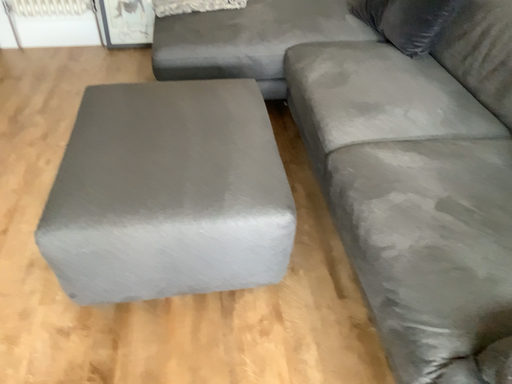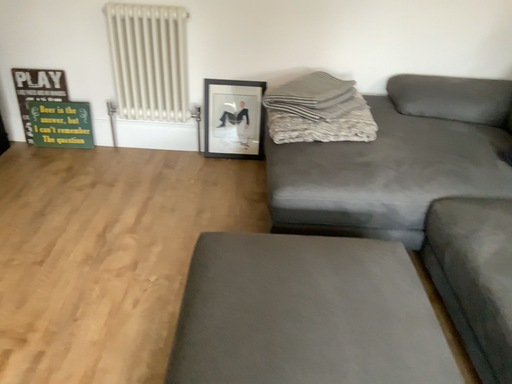
Question: How did the camera likely rotate when shooting the video?

Choices:
 (A) rotated upward
 (B) rotated downward

Answer: (A)